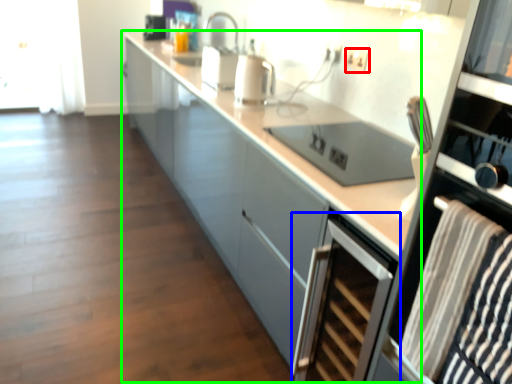
Question: Estimate the real-world distances between objects in this image. Which object is closer to electric outlet (highlighted by a red box), home appliance (highlighted by a blue box) or cabinetry (highlighted by a green box)?

Choices:
 (A) home appliance
 (B) cabinetry

Answer: (B)